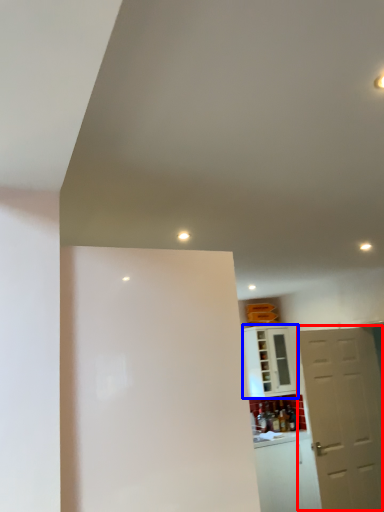
Question: Which object is closer to the camera taking this photo, door (highlighted by a red box) or cabinetry (highlighted by a blue box)?

Choices:
 (A) door
 (B) cabinetry

Answer: (A)